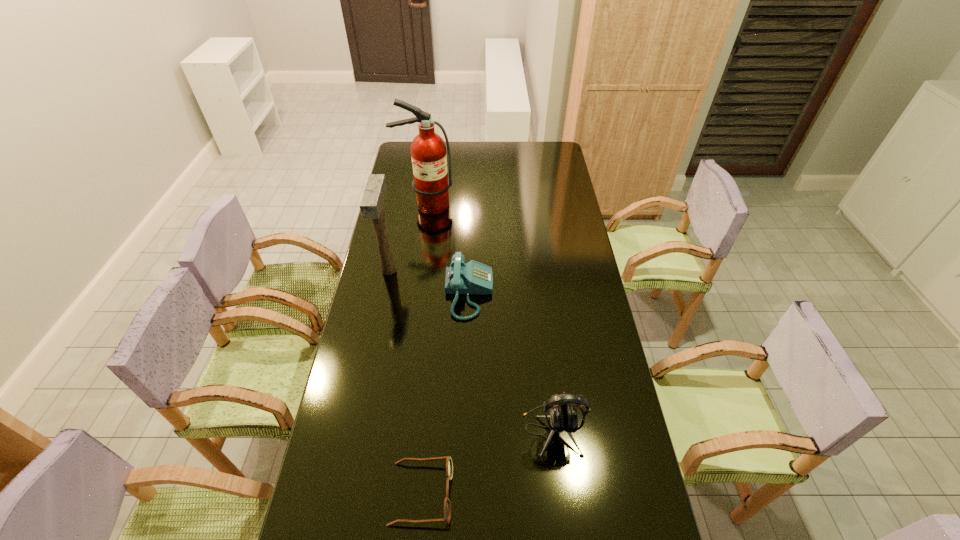
Find the location of a particular element. the farthest object is located at coordinates (431, 183).

The image size is (960, 540). What are the coordinates of `fire extinguisher` in the screenshot? It's located at (431, 183).

You are a GUI agent. You are given a task and a screenshot of the screen. Output one action in this format:
    pyautogui.click(x=<x>, y=<y>)
    Task: Click on the mallet
    
    Given the screenshot: What is the action you would take?
    [x=371, y=206]

At what (x,y) coordinates should I click in order to perform the action: click on the third tallest object. Please return your answer as a coordinate pair (x, y). Looking at the image, I should click on (563, 417).

What are the coordinates of `the second nearest object` in the screenshot? It's located at (563, 417).

Where is `the second shortest object`? The height and width of the screenshot is (540, 960). the second shortest object is located at coordinates (475, 278).

In order to click on the nearest object in this screenshot , I will do `click(449, 465)`.

The image size is (960, 540). What are the coordinates of `spectacles` in the screenshot? It's located at (449, 465).

This screenshot has width=960, height=540. Identify the location of vacant space positioned 0.080m on the nozzle and handle of the farthest object. (422, 227).

What are the coordinates of `vacant area located on the right of the fourth shortest object` in the screenshot? It's located at (437, 271).